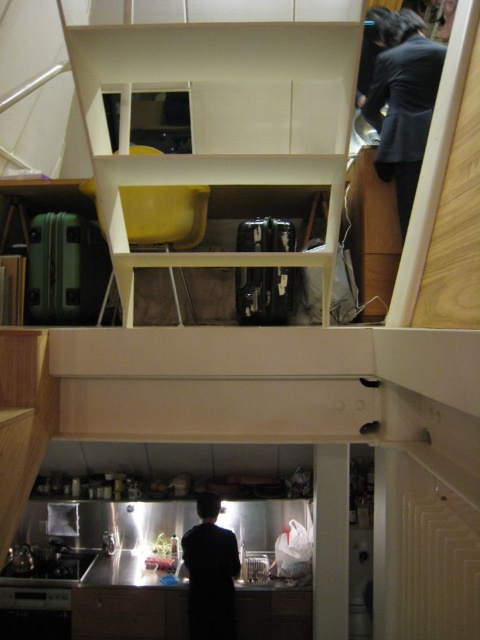
Question: Does dark blue suit at upper right appear under dark matte shirt at lower center?

Choices:
 (A) no
 (B) yes

Answer: (A)

Question: Which point is farther from the camera taking this photo?

Choices:
 (A) (215, 604)
 (B) (392, 13)

Answer: (A)

Question: Can you confirm if dark matte shirt at lower center is smaller than matte wood drawer at lower center?

Choices:
 (A) no
 (B) yes

Answer: (A)

Question: Which of the following is the closest to the observer?

Choices:
 (A) dark blue suit at upper right
 (B) matte wood drawer at lower center
 (C) dark matte shirt at lower center

Answer: (A)

Question: Does dark blue suit at upper right have a larger size compared to dark matte shirt at lower center?

Choices:
 (A) no
 (B) yes

Answer: (A)

Question: Which of the following is the closest to the observer?

Choices:
 (A) (111, 614)
 (B) (223, 614)

Answer: (B)